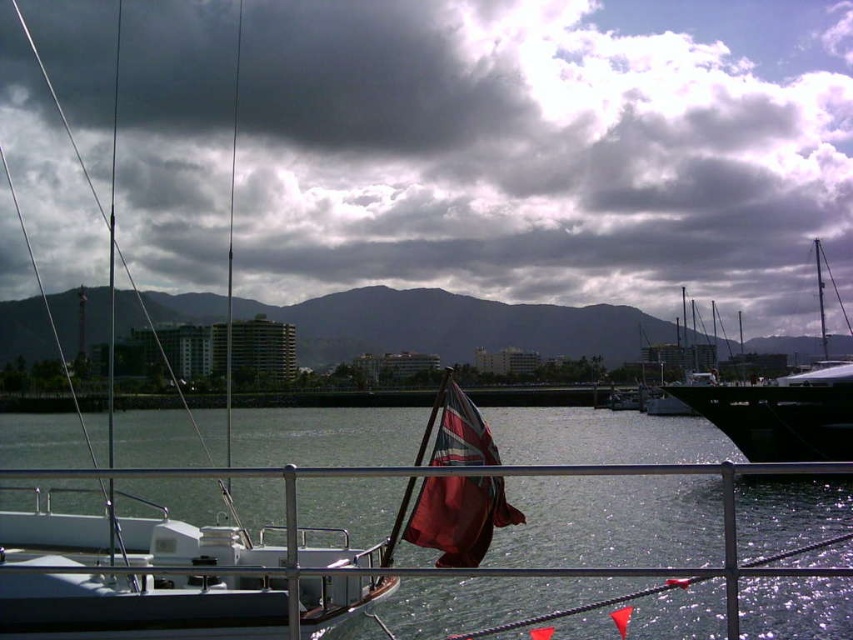
Which is in front, point (354, 72) or point (821, 276)?

Positioned in front is point (821, 276).

Measure the distance between cloudy sky at upper center and camera.

A: cloudy sky at upper center and camera are 97.92 meters apart.

Find the location of a particular element. Image resolution: width=853 pixels, height=640 pixels. cloudy sky at upper center is located at coordinates (547, 148).

Find the location of a particular element. cloudy sky at upper center is located at coordinates (547, 148).

The image size is (853, 640). Describe the element at coordinates (547, 148) in the screenshot. I see `cloudy sky at upper center` at that location.

Between cloudy sky at upper center and red fabric flag at center, which one appears on the right side from the viewer's perspective?

From the viewer's perspective, red fabric flag at center appears more on the right side.

In the scene shown: Who is more distant from viewer, (x=381, y=173) or (x=498, y=509)?

Positioned behind is point (x=381, y=173).

Identify the location of cloudy sky at upper center. The image size is (853, 640). (547, 148).

Between cloudy sky at upper center and dark brown mountain at center, which one appears on the right side from the viewer's perspective?

From the viewer's perspective, cloudy sky at upper center appears more on the right side.

In the scene shown: Does cloudy sky at upper center lie behind dark brown mountain at center?

Yes, it is behind dark brown mountain at center.

Is point (62, 173) more distant than point (20, 336)?

Yes, it is behind point (20, 336).

At what (x,y) coordinates should I click in order to perform the action: click on cloudy sky at upper center. Please return your answer as a coordinate pair (x, y). Looking at the image, I should click on (547, 148).